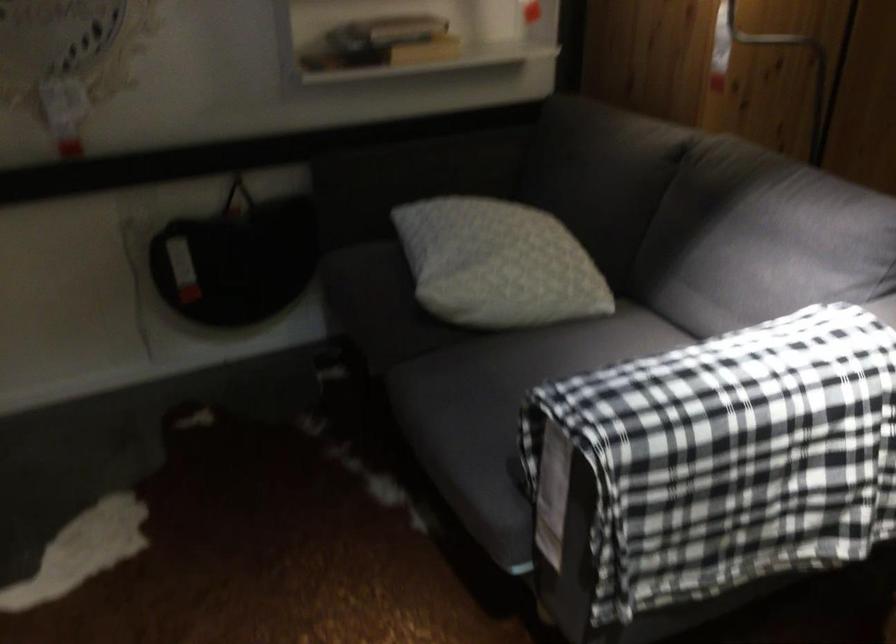
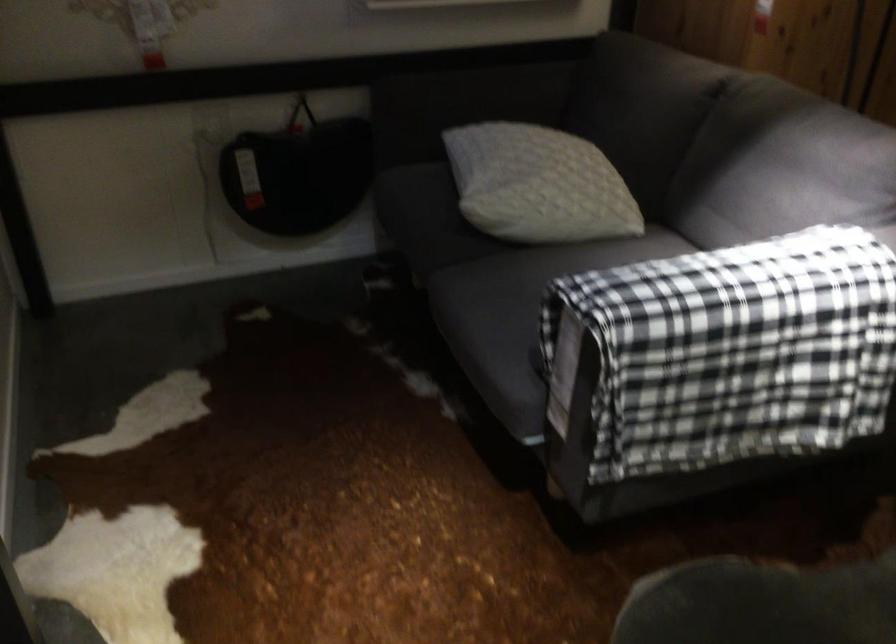
In the second image, find the point that corresponds to point (757, 503) in the first image.

(745, 388)